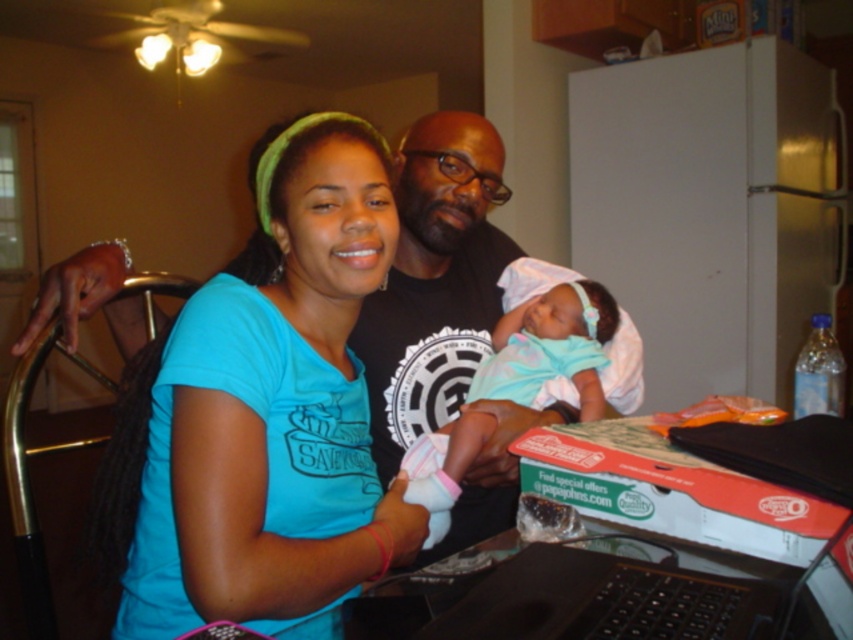
You are a photographer setting up a shoot in this scene. You need to position a spotlight so it illuminates both the matte blue shirt at center and the light blue fabric at center without casting shadows on the background. Given their positions, which object should the spotlight be angled towards first to ensure both are lit properly?

The spotlight should be angled towards the matte blue shirt at center first because it is taller than the light blue fabric at center, ensuring both are illuminated without casting shadows on the background.

You are a delivery person who just arrived at the house. You see the matte blue shirt at center and the cardboard pizza box at lower right. Which object is taller when viewed from the front?

The matte blue shirt at center has a greater height compared to the cardboard pizza box at lower right, so the matte blue shirt at center is taller.

Please look at the point located at coordinates (265, 410). Based on the scene described, which object does this point lie on?

The point at coordinates (265, 410) lies on the matte blue shirt at center.